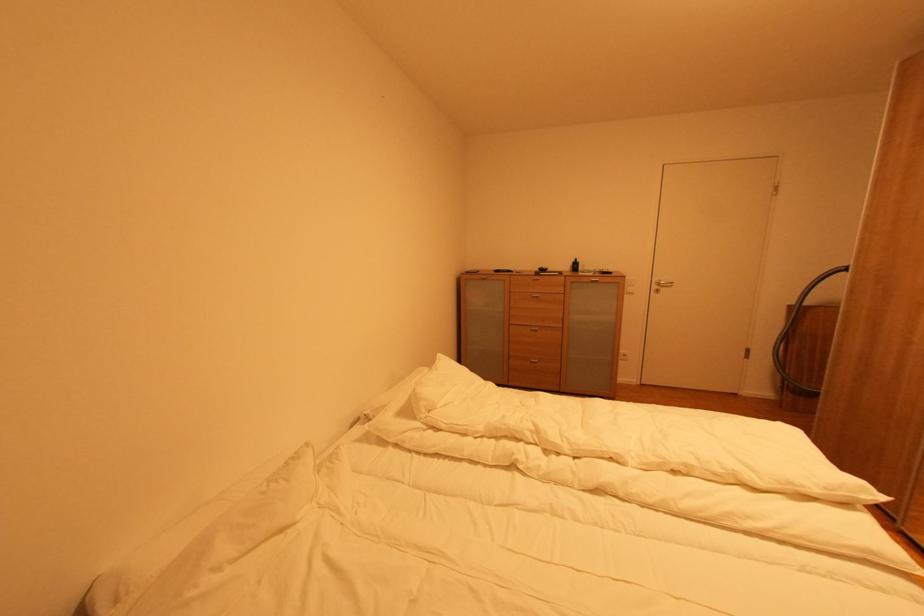
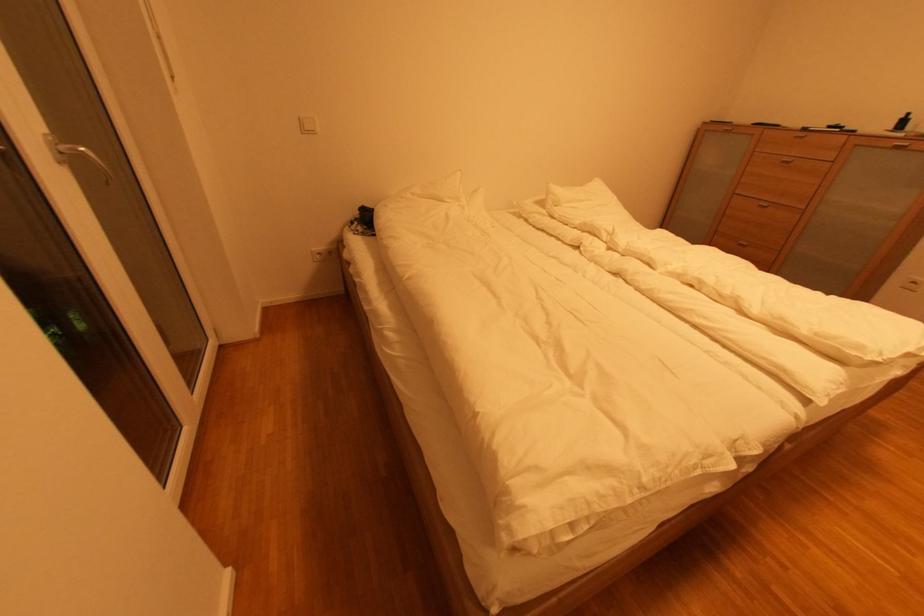
Where in the second image is the point corresponding to point 541,363 from the first image?

(749, 246)